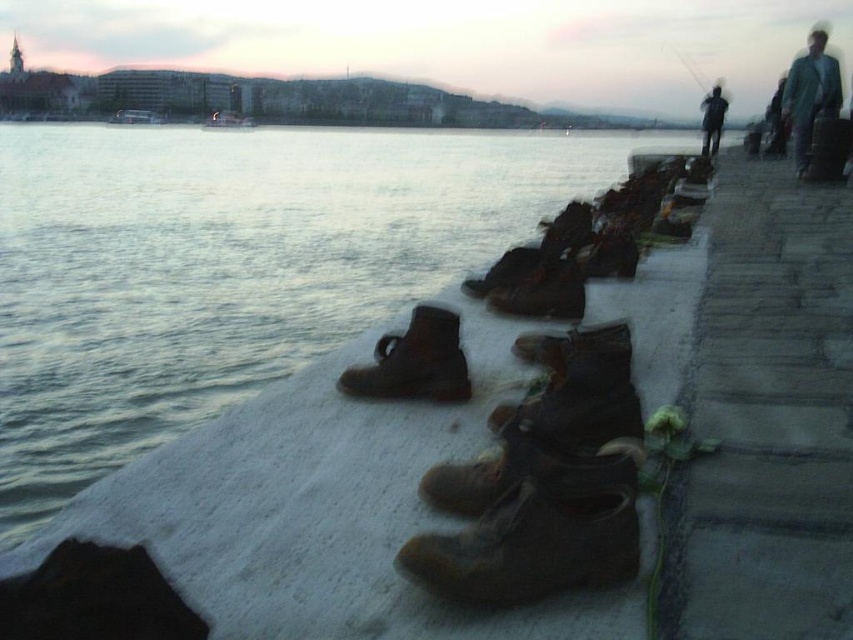
You are standing at the riverside and see the point marked at coordinates [534,444]. What object is located at that point?

The point at coordinates [534,444] indicates leather shoes at center.